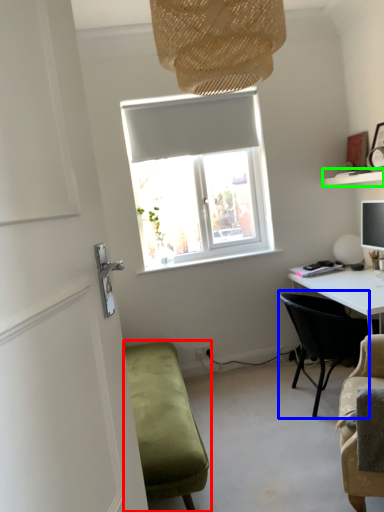
Question: Based on their relative distances, which object is nearer to studio couch (highlighted by a red box)? Choose from chair (highlighted by a blue box) and shelf (highlighted by a green box).

Choices:
 (A) chair
 (B) shelf

Answer: (A)